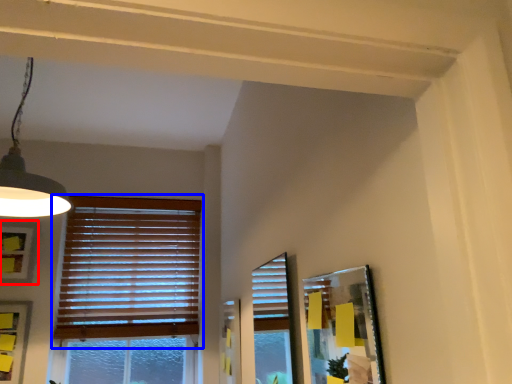
Question: Which object is further to the camera taking this photo, picture frame (highlighted by a red box) or window blind (highlighted by a blue box)?

Choices:
 (A) picture frame
 (B) window blind

Answer: (B)